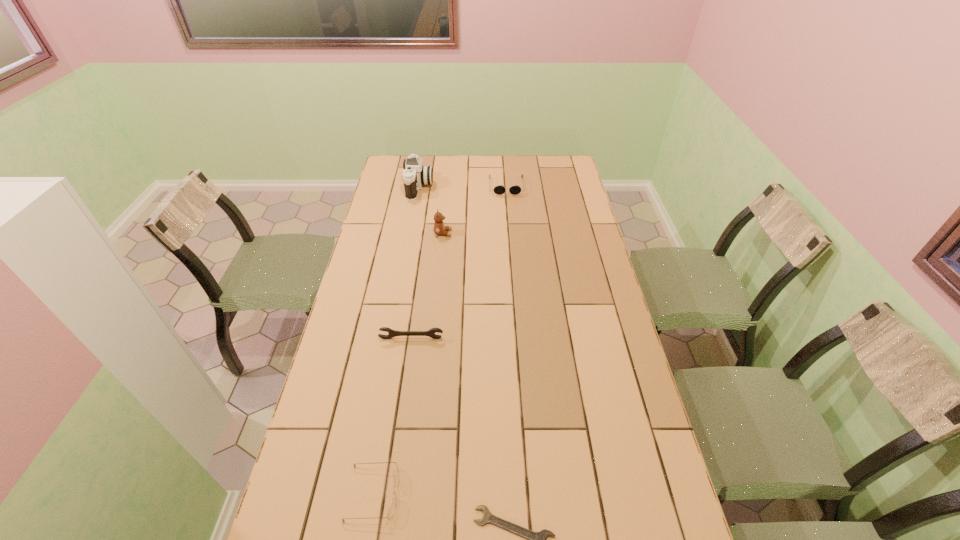
The height and width of the screenshot is (540, 960). What are the coordinates of `the second closest object to the fourth farthest object` in the screenshot? It's located at (439, 228).

Locate which object is the second closest to the camera. Please provide its 2D coordinates. Your answer should be formatted as a tuple, i.e. [(x, y)], where the tuple contains the x and y coordinates of a point satisfying the conditions above.

[(498, 189)]

This screenshot has width=960, height=540. Identify the location of vacant space that satisfies the following two spatial constraints: 1. on the open ends of the fourth farthest object; 2. on the front-facing side of the fifth tallest object. (390, 493).

The width and height of the screenshot is (960, 540). I want to click on free spot that satisfies the following two spatial constraints: 1. on the front-facing side of the sunglasses; 2. on the front-facing side of the spectacles, so click(x=531, y=493).

You are a GUI agent. You are given a task and a screenshot of the screen. Output one action in this format:
    pyautogui.click(x=<x>, y=<y>)
    Task: Click on the free spot that satisfies the following two spatial constraints: 1. on the open ends of the left wrench; 2. on the front-facing side of the spectacles
    The width and height of the screenshot is (960, 540).
    Given the screenshot: What is the action you would take?
    pyautogui.click(x=390, y=493)

Locate an element on the screen. The height and width of the screenshot is (540, 960). free region that satisfies the following two spatial constraints: 1. on the front-facing side of the sunglasses; 2. on the front-facing side of the third farthest object is located at coordinates (510, 233).

The image size is (960, 540). I want to click on free space that satisfies the following two spatial constraints: 1. on the front-facing side of the sunglasses; 2. on the front-facing side of the teddy bear, so click(510, 233).